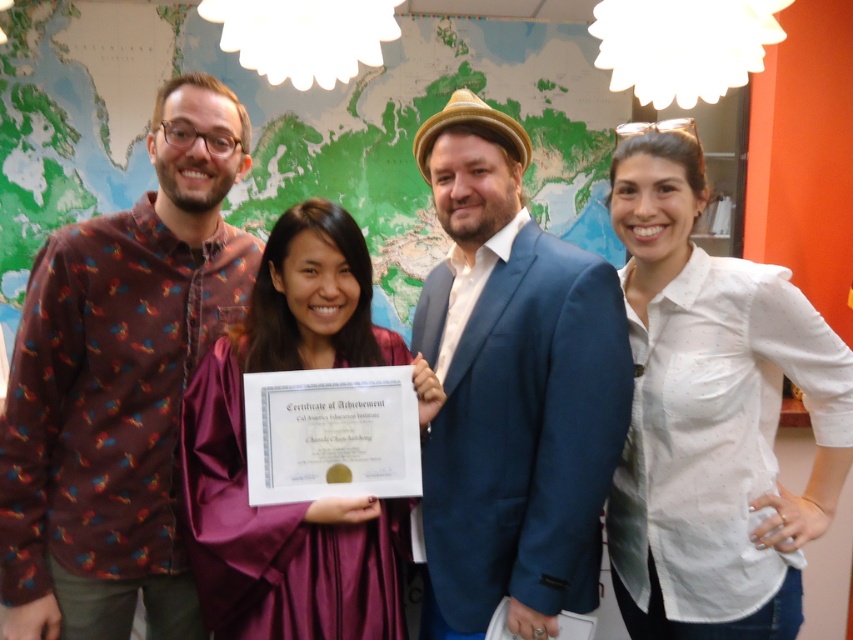
You are a photographer trying to capture a photo of the brown printed shirt at left and the blue fabric suit at center. Based on their positions, which one is higher in the frame?

The brown printed shirt at left is located above the blue fabric suit at center, so it is higher in the frame.

Consider the image. You are standing in the room and want to move from the point at coordinates point (201, 244) to the point at coordinates point (631, 461). Which direction should you move in to get closer to your destination?

Since point (201, 244) is further to the viewer than point (631, 461), you should move backward to get closer to point (631, 461).